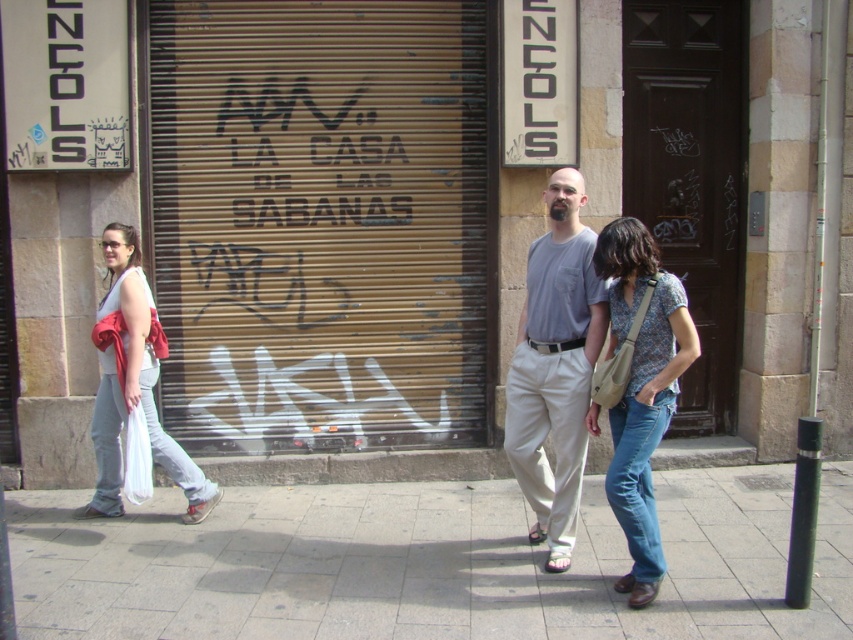
Question: Where is light gray cotton shirt at center located in relation to floral print shirt at center in the image?

Choices:
 (A) right
 (B) left

Answer: (B)

Question: Estimate the real-world distances between objects in this image. Which object is closer to the gold metallic garage door at center?

Choices:
 (A) brown wooden door at right
 (B) gray concrete pavement at center
 (C) light blue jeans at left
 (D) floral print shirt at center

Answer: (C)

Question: Among these objects, which one is farthest from the camera?

Choices:
 (A) gold metallic garage door at center
 (B) gray concrete pavement at center
 (C) floral print shirt at center
 (D) light blue jeans at left

Answer: (A)

Question: Among these objects, which one is farthest from the camera?

Choices:
 (A) gold metallic garage door at center
 (B) light blue jeans at left
 (C) floral print shirt at center
 (D) light gray cotton shirt at center

Answer: (A)

Question: Can you confirm if light gray cotton shirt at center is wider than floral print shirt at center?

Choices:
 (A) yes
 (B) no

Answer: (A)

Question: Can you confirm if gold metallic garage door at center is bigger than floral print shirt at center?

Choices:
 (A) yes
 (B) no

Answer: (A)